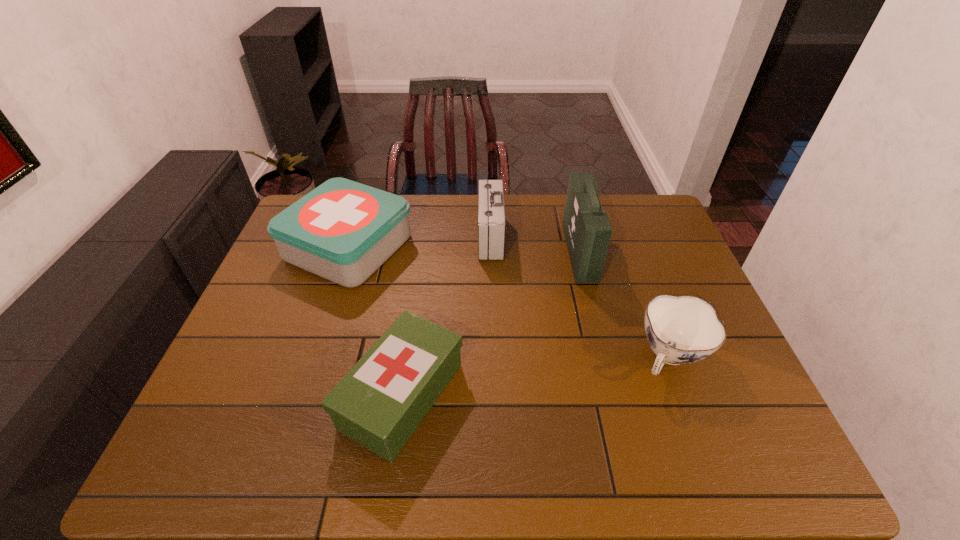
The image size is (960, 540). I want to click on the tallest object, so click(x=587, y=229).

Locate an element on the screen. the rightmost first-aid kit is located at coordinates 587,229.

At what (x,y) coordinates should I click in order to perform the action: click on the second first-aid kit from right to left. Please return your answer as a coordinate pair (x, y). This screenshot has width=960, height=540. Looking at the image, I should click on (491, 213).

This screenshot has width=960, height=540. I want to click on chinaware, so click(x=684, y=329).

In order to click on the nearest first-aid kit in this screenshot , I will do `click(379, 403)`.

Identify the location of vacant area situated 0.210m on the front-facing side of the tallest object. The image size is (960, 540). point(502,252).

Locate an element on the screen. Image resolution: width=960 pixels, height=540 pixels. free point located on the front-facing side of the tallest object is located at coordinates (470, 252).

In order to click on vacant region located 0.120m on the front-facing side of the tallest object in this screenshot , I will do `click(531, 252)`.

Find the location of a particular element. blank space located on the front-facing side of the third object from left to right is located at coordinates (408, 237).

Locate an element on the screen. vacant space situated on the front-facing side of the third object from left to right is located at coordinates (363, 237).